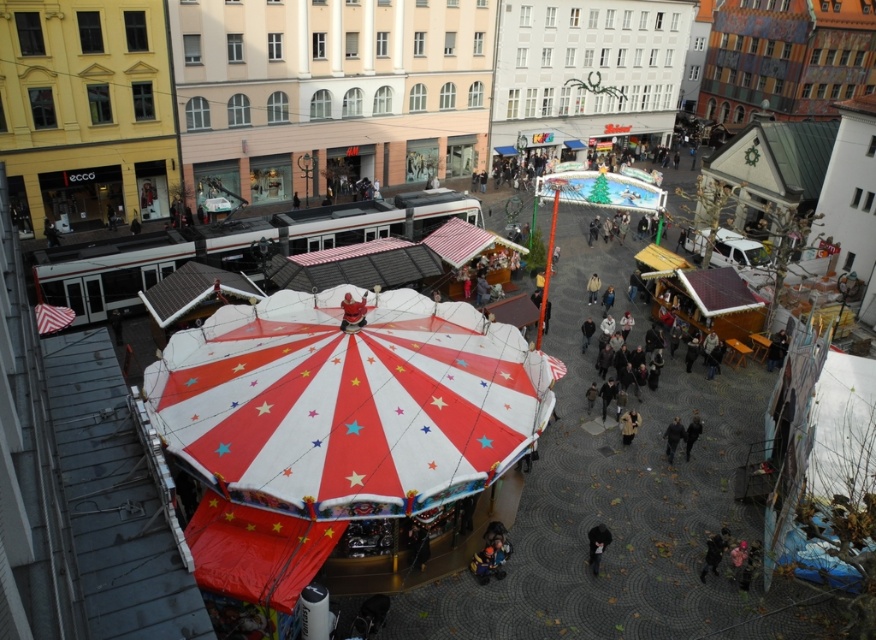
What is the color of the object located at the coordinates (352,312) in the image?

The object at coordinates (352,312) is a matte red coat at center.

Consider the image. You are standing on a balcony overlooking the scene. You see the red and white striped umbrella at center and the dark gray coat at center. Which object is higher from the ground?

The red and white striped umbrella at center is above the dark gray coat at center, so it is higher from the ground.